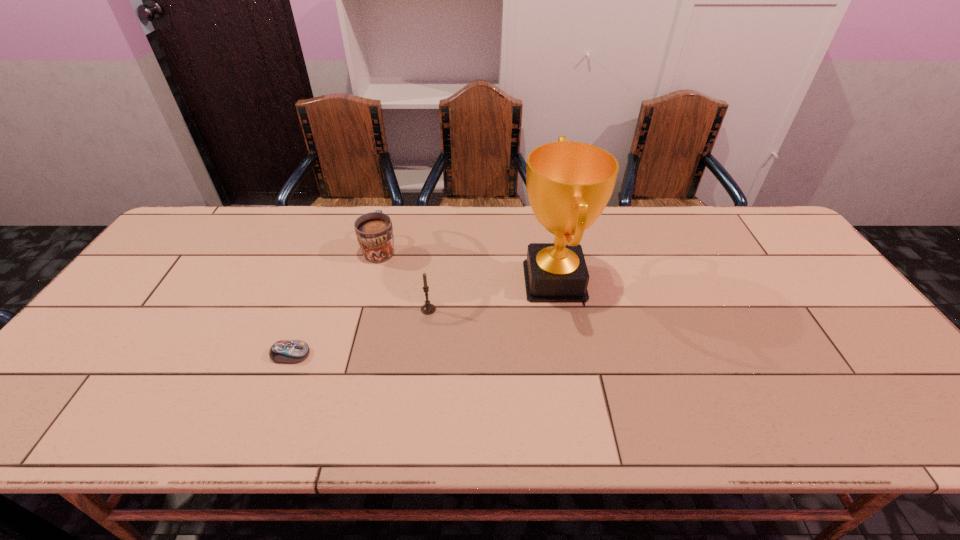
Find the location of a particular element. free spot located on the side of the third object from right to left with the handle is located at coordinates (391, 207).

This screenshot has width=960, height=540. I want to click on vacant space located 0.050m on the side of the third object from right to left with the handle, so click(x=387, y=224).

Locate an element on the screen. This screenshot has width=960, height=540. free point located on the side of the third object from right to left with the handle is located at coordinates (391, 207).

You are a GUI agent. You are given a task and a screenshot of the screen. Output one action in this format:
    pyautogui.click(x=<x>, y=<y>)
    Task: Click on the free point located on the wheel side of the computer mouse
    
    Given the screenshot: What is the action you would take?
    [409, 354]

The width and height of the screenshot is (960, 540). I want to click on award located at the far edge, so click(569, 184).

Where is `mug positioned at the far edge`? Image resolution: width=960 pixels, height=540 pixels. mug positioned at the far edge is located at coordinates (374, 231).

Where is `vacant area at the far edge`? The width and height of the screenshot is (960, 540). vacant area at the far edge is located at coordinates (461, 246).

Identify the location of vacant space at the near edge of the desktop. The width and height of the screenshot is (960, 540). (216, 408).

This screenshot has height=540, width=960. I want to click on free space at the right edge, so click(823, 334).

Where is `vacant space at the far left corner`? This screenshot has height=540, width=960. vacant space at the far left corner is located at coordinates (165, 246).